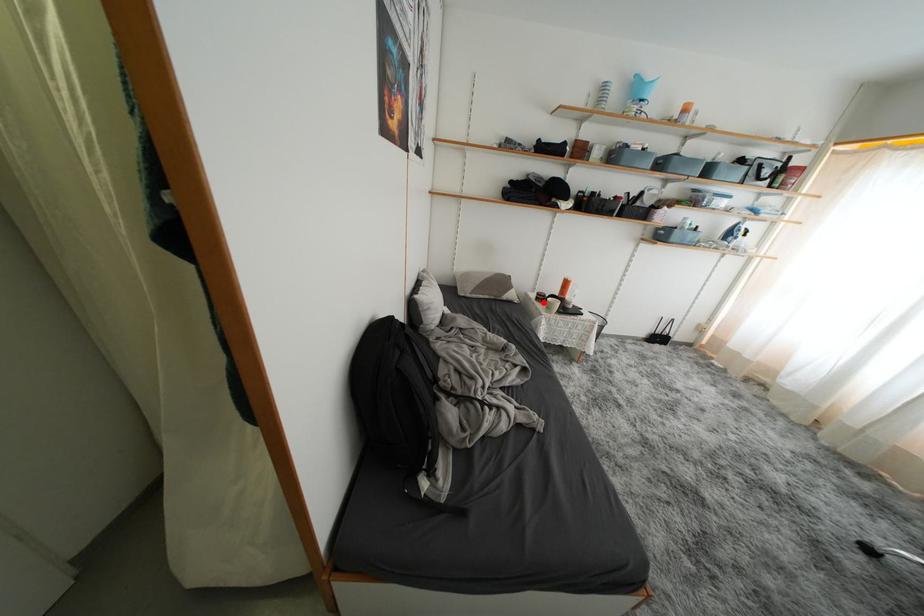
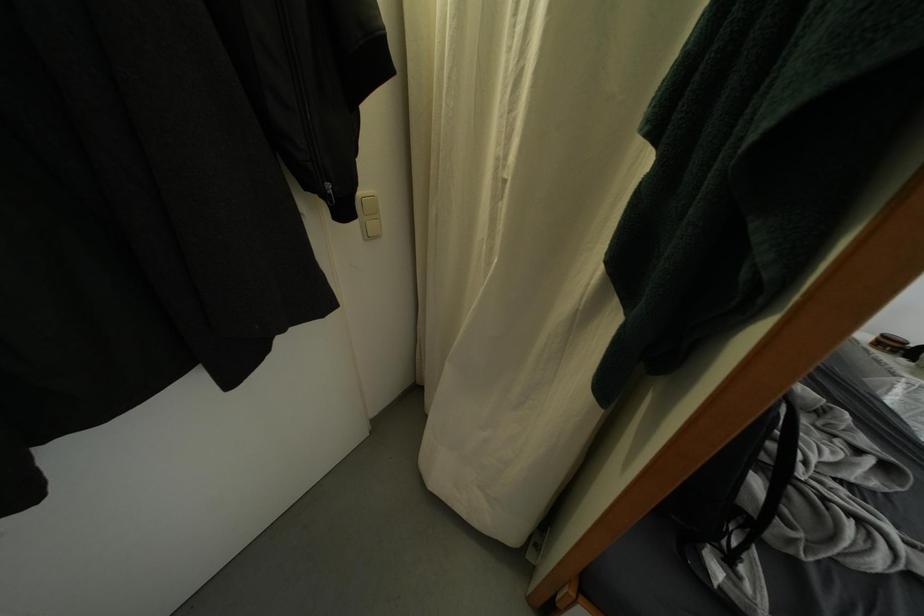
Locate, in the second image, the point that corresponds to the highlighted location in the first image.

(884, 347)